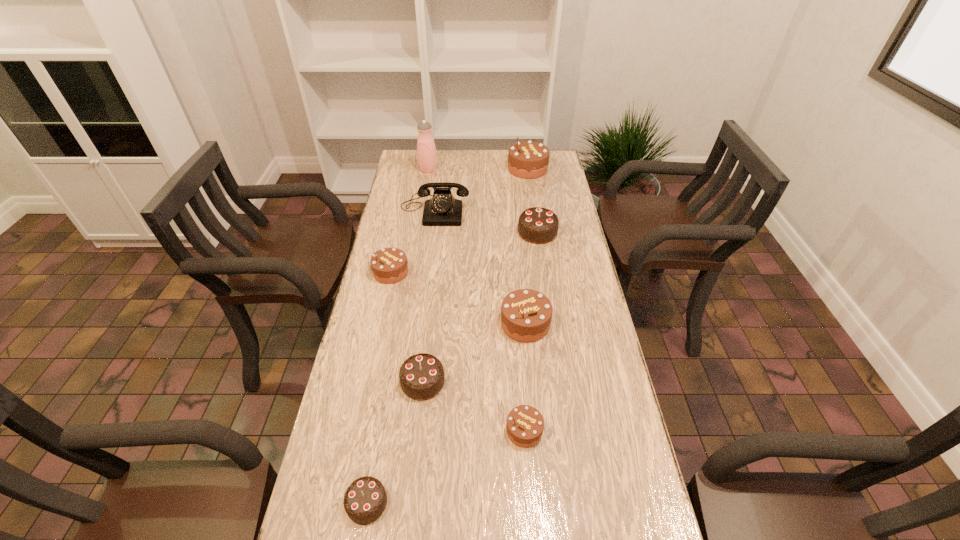
Find the location of `object present at the far right corner`. object present at the far right corner is located at coordinates (527, 159).

You are a GUI agent. You are given a task and a screenshot of the screen. Output one action in this format:
    pyautogui.click(x=<x>, y=<y>)
    Task: Click on the free spot at the far edge of the desktop
    This screenshot has height=540, width=960.
    Given the screenshot: What is the action you would take?
    pyautogui.click(x=473, y=152)

This screenshot has height=540, width=960. In order to click on free space at the left edge in this screenshot , I will do `click(420, 236)`.

This screenshot has width=960, height=540. Find the location of `free space at the right edge of the desktop`. free space at the right edge of the desktop is located at coordinates (556, 308).

The height and width of the screenshot is (540, 960). I want to click on free space between the tallest object and the nearest chocolate chocolate cake, so click(397, 336).

Locate an element on the screen. The width and height of the screenshot is (960, 540). vacant region between the seventh farthest object and the nearest chocolate chocolate cake is located at coordinates (395, 442).

Image resolution: width=960 pixels, height=540 pixels. Identify the location of blank region between the nearest chocolate cake and the third farthest chocolate cake. (379, 387).

Find the location of a particular element. unoccupied area between the thermos bottle and the second farthest chocolate chocolate cake is located at coordinates (425, 276).

Where is `vacant space in between the farthest chocolate cake and the smallest chocolate chocolate cake`? This screenshot has height=540, width=960. vacant space in between the farthest chocolate cake and the smallest chocolate chocolate cake is located at coordinates (447, 336).

This screenshot has height=540, width=960. Find the location of `free point between the telephone and the farthest chocolate chocolate cake`. free point between the telephone and the farthest chocolate chocolate cake is located at coordinates (486, 221).